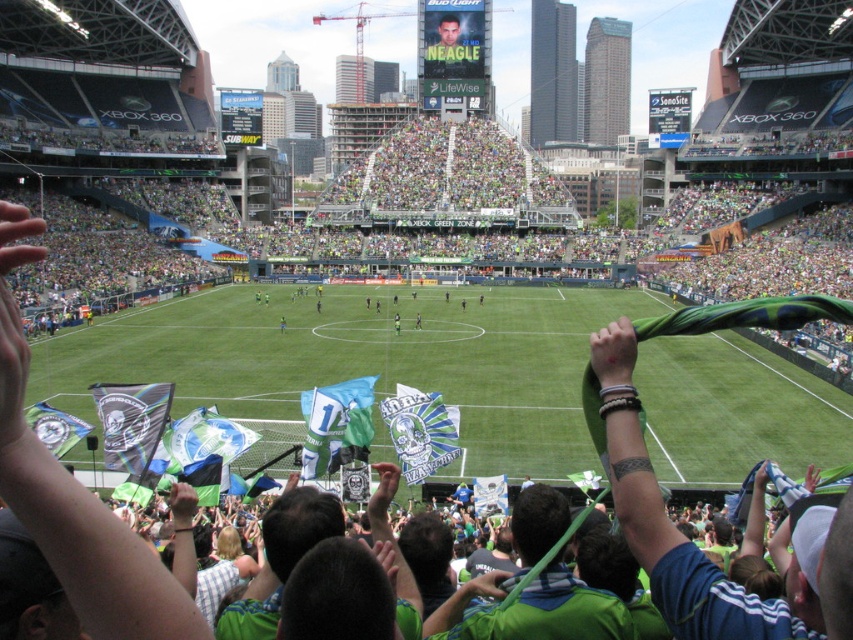
Question: Does green grass at center appear under green jersey at center?

Choices:
 (A) no
 (B) yes

Answer: (B)

Question: Which object is closer to the camera taking this photo?

Choices:
 (A) green fabric banner at center
 (B) green jersey at center
 (C) green grass at center

Answer: (A)

Question: Based on their relative distances, which object is nearer to the green jersey at center?

Choices:
 (A) green fabric banner at center
 (B) green grass at center

Answer: (B)

Question: Can you confirm if green grass at center is bigger than green jersey at center?

Choices:
 (A) yes
 (B) no

Answer: (A)

Question: Does green grass at center appear under green fabric banner at center?

Choices:
 (A) no
 (B) yes

Answer: (A)

Question: Which point is farther to the camera?

Choices:
 (A) green fabric banner at center
 (B) black matte flag at center

Answer: (A)